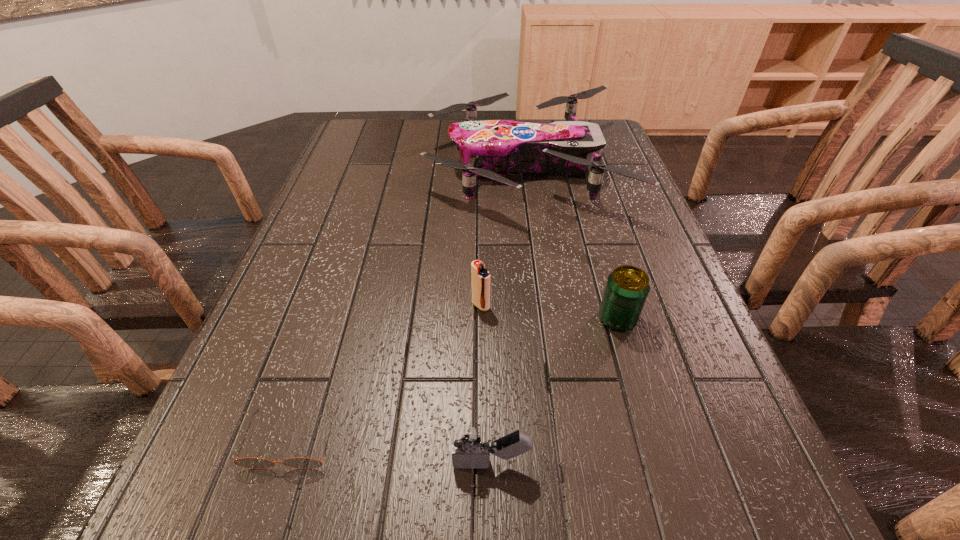
Locate an element on the screen. drone is located at coordinates (491, 148).

Where is `the nearer igniter`? The width and height of the screenshot is (960, 540). the nearer igniter is located at coordinates (471, 444).

At what (x,y) coordinates should I click in order to perform the action: click on beer can. Please return your answer as a coordinate pair (x, y). Looking at the image, I should click on (627, 288).

Where is `the farther igniter`? This screenshot has width=960, height=540. the farther igniter is located at coordinates (480, 276).

Find the location of a particular element. The height and width of the screenshot is (540, 960). sunglasses is located at coordinates (253, 463).

Find the location of `the leftmost object`. the leftmost object is located at coordinates (253, 463).

Where is `free space located on the front-facing side of the farthest object`? free space located on the front-facing side of the farthest object is located at coordinates (390, 168).

Where is `free space located 0.080m on the front-facing side of the farthest object`? free space located 0.080m on the front-facing side of the farthest object is located at coordinates (400, 168).

The width and height of the screenshot is (960, 540). In order to click on blank space located on the front-facing side of the farthest object in this screenshot , I will do coord(345,168).

The width and height of the screenshot is (960, 540). I want to click on vacant point located 0.250m on the right of the nearer igniter, so click(695, 463).